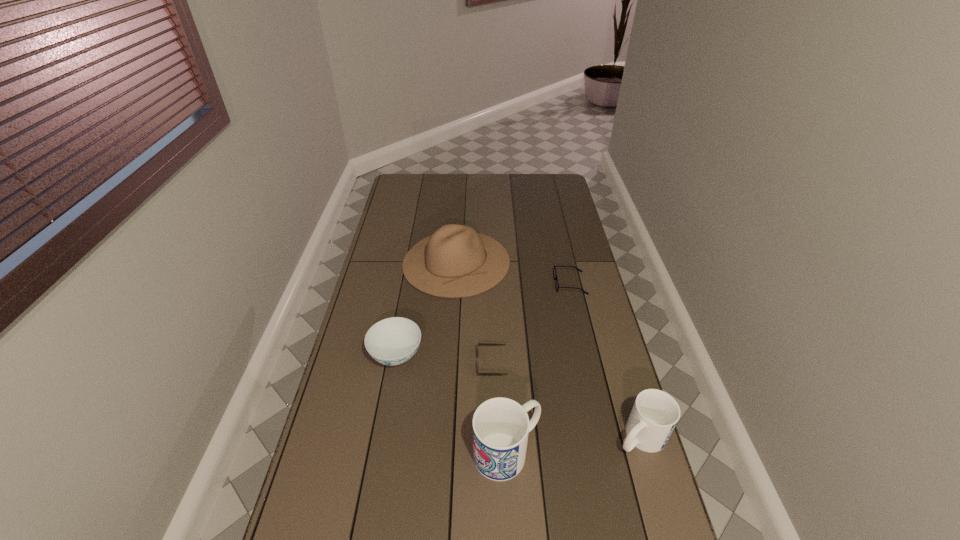
Identify the location of free space in the image that satisfies the following two spatial constraints: 1. on the front-facing side of the right mug; 2. on the right side of the sunglasses. (494, 437).

Where is `free point that satisfies the following two spatial constraints: 1. on the back side of the taller mug; 2. on the front-facing side of the sunglasses`? Image resolution: width=960 pixels, height=540 pixels. free point that satisfies the following two spatial constraints: 1. on the back side of the taller mug; 2. on the front-facing side of the sunglasses is located at coordinates (503, 363).

Where is `vacant space that satisfies the following two spatial constraints: 1. on the front-facing side of the spectacles; 2. on the back side of the third tallest object`? The width and height of the screenshot is (960, 540). vacant space that satisfies the following two spatial constraints: 1. on the front-facing side of the spectacles; 2. on the back side of the third tallest object is located at coordinates (606, 437).

Locate an element on the screen. free space that satisfies the following two spatial constraints: 1. on the back side of the left mug; 2. on the right side of the third tallest object is located at coordinates (506, 437).